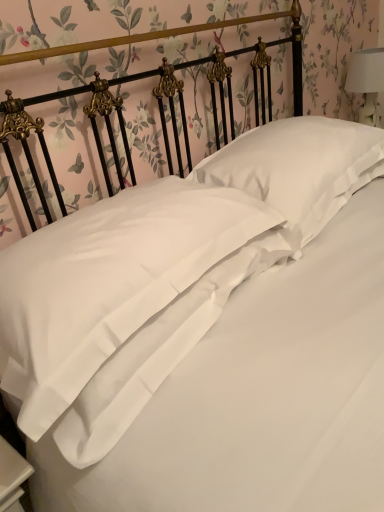
What is the approximate width of white satin pillow at center, the 2th pillow positioned from the left?

The width of white satin pillow at center, the 2th pillow positioned from the left, is 19.16 inches.

The image size is (384, 512). Describe the element at coordinates (108, 282) in the screenshot. I see `satin white pillow at center, which is counted as the 1th pillow, starting from the left` at that location.

The height and width of the screenshot is (512, 384). In order to click on white satin pillow at center, which is the first pillow in right-to-left order in this screenshot , I will do `click(299, 167)`.

Is point (121, 324) positioned after point (287, 196)?

No.

From the image's perspective, which is above, satin white pillow at center, which is counted as the 1th pillow, starting from the left, or white satin pillow at center, which is the first pillow in right-to-left order?

From the image's view, white satin pillow at center, which is the first pillow in right-to-left order, is above.

From a real-world perspective, is satin white pillow at center, which is counted as the 1th pillow, starting from the left, positioned above or below white satin pillow at center, which is the first pillow in right-to-left order?

satin white pillow at center, which is counted as the 1th pillow, starting from the left, is below white satin pillow at center, which is the first pillow in right-to-left order.

Consider the image. Can you confirm if satin white pillow at center, which is counted as the 1th pillow, starting from the left, is positioned to the right of white satin pillow at center, the 2th pillow positioned from the left?

No, satin white pillow at center, which is counted as the 1th pillow, starting from the left, is not to the right of white satin pillow at center, the 2th pillow positioned from the left.

Can you tell me how much white fabric lampshade at upper right and white satin pillow at center, the 2th pillow positioned from the left, differ in facing direction?

The angle between the facing direction of white fabric lampshade at upper right and the facing direction of white satin pillow at center, the 2th pillow positioned from the left, is 4.59 degrees.

Which of these two, white fabric lampshade at upper right or white satin pillow at center, the 2th pillow positioned from the left, stands shorter?

white satin pillow at center, the 2th pillow positioned from the left.

From the picture: Considering the relative positions of white fabric lampshade at upper right and white satin pillow at center, the 2th pillow positioned from the left, in the image provided, is white fabric lampshade at upper right behind white satin pillow at center, the 2th pillow positioned from the left,?

That is True.

Is white satin pillow at center, the 2th pillow positioned from the left, at the back of white fabric lampshade at upper right?

No, white satin pillow at center, the 2th pillow positioned from the left, is not at the back of white fabric lampshade at upper right.

Locate an element on the screen. This screenshot has width=384, height=512. the 2nd pillow below the white fabric lampshade at upper right (from the image's perspective) is located at coordinates (108, 282).

Based on the photo, from the image's perspective, is white fabric lampshade at upper right below satin white pillow at center, which is counted as the 1th pillow, starting from the left?

No.

Which object is positioned more to the left, white fabric lampshade at upper right or satin white pillow at center, which is counted as the 1th pillow, starting from the left?

Positioned to the left is satin white pillow at center, which is counted as the 1th pillow, starting from the left.

From the image's perspective, is white satin pillow at center, which is the first pillow in right-to-left order, located beneath white fabric lampshade at upper right?

Yes, from the image's perspective, white satin pillow at center, which is the first pillow in right-to-left order, is below white fabric lampshade at upper right.

Would you say white fabric lampshade at upper right is part of white satin pillow at center, which is the first pillow in right-to-left order,'s contents?

Definitely not — white fabric lampshade at upper right is not inside white satin pillow at center, which is the first pillow in right-to-left order.

Consider the image. From a real-world perspective, which is physically below, white satin pillow at center, which is the first pillow in right-to-left order, or white fabric lampshade at upper right?

white satin pillow at center, which is the first pillow in right-to-left order, from a real-world perspective.

Does white satin pillow at center, which is the first pillow in right-to-left order, have a lesser height compared to white fabric lampshade at upper right?

Indeed, white satin pillow at center, which is the first pillow in right-to-left order, has a lesser height compared to white fabric lampshade at upper right.

Is satin white pillow at center, which is counted as the 1th pillow, starting from the left, not close to white fabric lampshade at upper right?

Indeed, satin white pillow at center, which is counted as the 1th pillow, starting from the left, is not near white fabric lampshade at upper right.

The height and width of the screenshot is (512, 384). I want to click on bedside lamp above the satin white pillow at center, marked as the second pillow in a right-to-left arrangement (from the image's perspective), so click(x=366, y=81).

Is satin white pillow at center, which is counted as the 1th pillow, starting from the left, turned away from white fabric lampshade at upper right?

No.

Does satin white pillow at center, which is counted as the 1th pillow, starting from the left, have a greater width compared to white fabric lampshade at upper right?

Yes.

Looking at this image, from the image's perspective, is white satin pillow at center, which is the first pillow in right-to-left order, under satin white pillow at center, marked as the second pillow in a right-to-left arrangement?

No, from the image's perspective, white satin pillow at center, which is the first pillow in right-to-left order, is not beneath satin white pillow at center, marked as the second pillow in a right-to-left arrangement.

Locate an element on the screen. pillow below the white satin pillow at center, which is the first pillow in right-to-left order (from the image's perspective) is located at coordinates (108, 282).

Can you confirm if white satin pillow at center, which is the first pillow in right-to-left order, is taller than satin white pillow at center, marked as the second pillow in a right-to-left arrangement?

Yes, white satin pillow at center, which is the first pillow in right-to-left order, is taller than satin white pillow at center, marked as the second pillow in a right-to-left arrangement.

Identify the location of pillow below the white satin pillow at center, the 2th pillow positioned from the left (from the image's perspective). (108, 282).

Identify the location of bedside lamp that appears above the white satin pillow at center, which is the first pillow in right-to-left order (from a real-world perspective). This screenshot has width=384, height=512. (366, 81).

When comparing their distances from white fabric lampshade at upper right, does white satin pillow at center, the 2th pillow positioned from the left, or satin white pillow at center, which is counted as the 1th pillow, starting from the left, seem further?

satin white pillow at center, which is counted as the 1th pillow, starting from the left, is further to white fabric lampshade at upper right.

When comparing their distances from white satin pillow at center, the 2th pillow positioned from the left, does white fabric lampshade at upper right or satin white pillow at center, marked as the second pillow in a right-to-left arrangement, seem closer?

The object closer to white satin pillow at center, the 2th pillow positioned from the left, is satin white pillow at center, marked as the second pillow in a right-to-left arrangement.

Looking at the image, which one is located further to satin white pillow at center, which is counted as the 1th pillow, starting from the left, white satin pillow at center, the 2th pillow positioned from the left, or white fabric lampshade at upper right?

white fabric lampshade at upper right.

Which object lies nearer to the anchor point white fabric lampshade at upper right, satin white pillow at center, which is counted as the 1th pillow, starting from the left, or white satin pillow at center, which is the first pillow in right-to-left order?

white satin pillow at center, which is the first pillow in right-to-left order.

Looking at the image, which one is located closer to satin white pillow at center, which is counted as the 1th pillow, starting from the left, white fabric lampshade at upper right or white satin pillow at center, the 2th pillow positioned from the left?

white satin pillow at center, the 2th pillow positioned from the left, lies closer to satin white pillow at center, which is counted as the 1th pillow, starting from the left, than the other object.

Based on their spatial positions, is satin white pillow at center, which is counted as the 1th pillow, starting from the left, or white fabric lampshade at upper right closer to white satin pillow at center, the 2th pillow positioned from the left?

satin white pillow at center, which is counted as the 1th pillow, starting from the left, is closer to white satin pillow at center, the 2th pillow positioned from the left.

The image size is (384, 512). In order to click on pillow located between satin white pillow at center, marked as the second pillow in a right-to-left arrangement, and white fabric lampshade at upper right in the depth direction in this screenshot , I will do `click(299, 167)`.